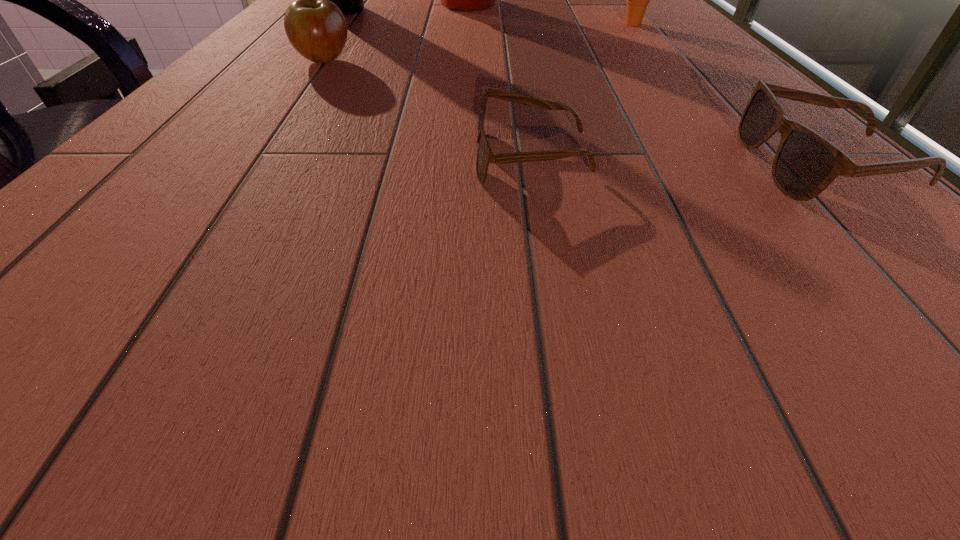
Image resolution: width=960 pixels, height=540 pixels. Identify the location of vacant space situated on the left of the fourth shortest object. (542, 24).

Where is `free space located on the right of the apple`? free space located on the right of the apple is located at coordinates (445, 61).

Find the location of a particular element. The height and width of the screenshot is (540, 960). free space located on the front-facing side of the liquor is located at coordinates (484, 10).

Identify the location of apple that is at the left edge. (316, 28).

Identify the location of liquor present at the left edge. The image size is (960, 540). (350, 0).

You are a GUI agent. You are given a task and a screenshot of the screen. Output one action in this format:
    pyautogui.click(x=<x>, y=<y>)
    Task: Click on the object at the right edge
    The width and height of the screenshot is (960, 540).
    Given the screenshot: What is the action you would take?
    pyautogui.click(x=637, y=0)

Find the location of `vacant space at the near edge of the desktop`. vacant space at the near edge of the desktop is located at coordinates (417, 260).

At what (x,y) coordinates should I click in order to perform the action: click on free location at the left edge of the desktop. Please return your answer as a coordinate pair (x, y). This screenshot has width=960, height=540. Looking at the image, I should click on pyautogui.click(x=233, y=75).

In the image, there is a desktop. Where is `free region at the near left corner`? free region at the near left corner is located at coordinates (85, 276).

Where is `free space at the near right corner of the desktop`? free space at the near right corner of the desktop is located at coordinates (942, 268).